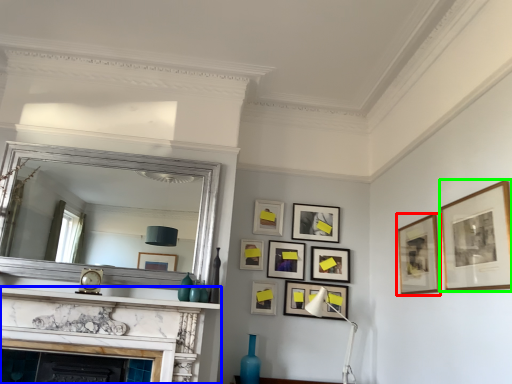
Question: Which object is positioned farthest from picture frame (highlighted by a red box)? Select from fireplace (highlighted by a blue box) and picture frame (highlighted by a green box).

Choices:
 (A) fireplace
 (B) picture frame

Answer: (A)